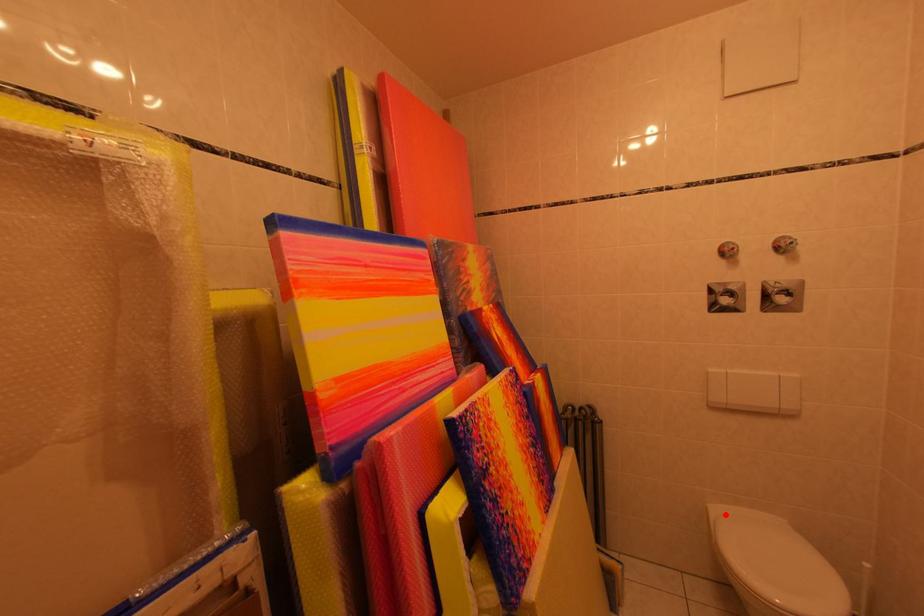
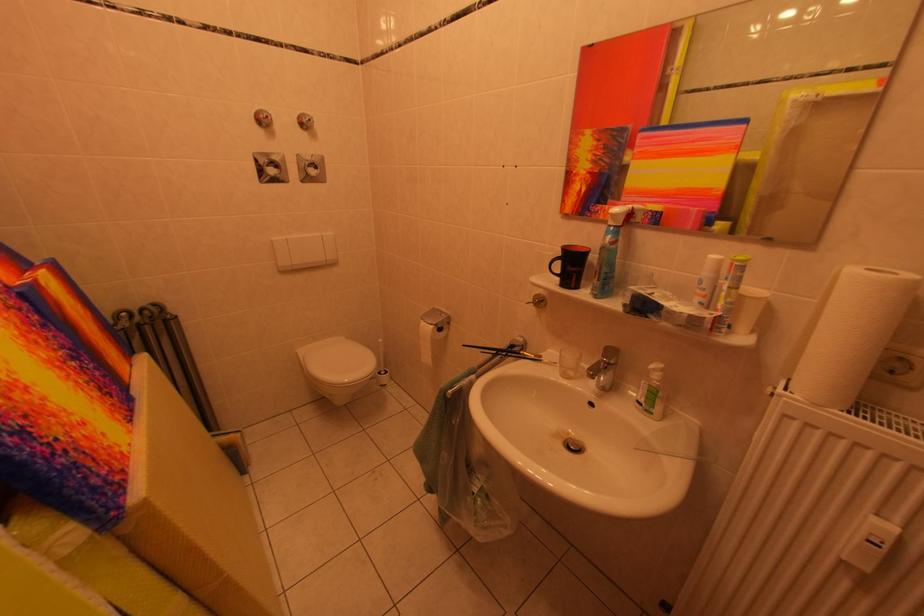
Locate, in the second image, the point that corresponds to the highlighted location in the first image.

(311, 355)